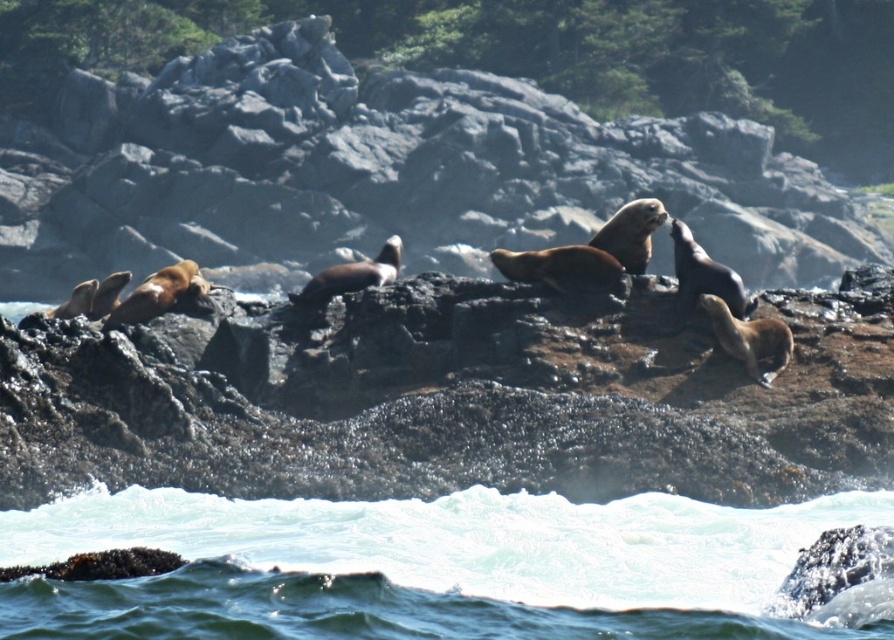
Question: Among these objects, which one is nearest to the camera?

Choices:
 (A) clear water at lower center
 (B) brown fur seal at center

Answer: (A)

Question: Which of the following is the closest to the observer?

Choices:
 (A) brown fur seal at center
 (B) brown rough rock at center

Answer: (B)

Question: Is brown rough rock at center further to the viewer compared to brown fur seal at center?

Choices:
 (A) no
 (B) yes

Answer: (A)

Question: Is brown fur seal at center in front of clear water at lower center?

Choices:
 (A) no
 (B) yes

Answer: (A)

Question: Which object appears closest to the camera in this image?

Choices:
 (A) brown fur seal at center
 (B) clear water at lower center

Answer: (B)

Question: Can you confirm if brown rough rock at center is positioned above brown fur seal at center?

Choices:
 (A) no
 (B) yes

Answer: (A)